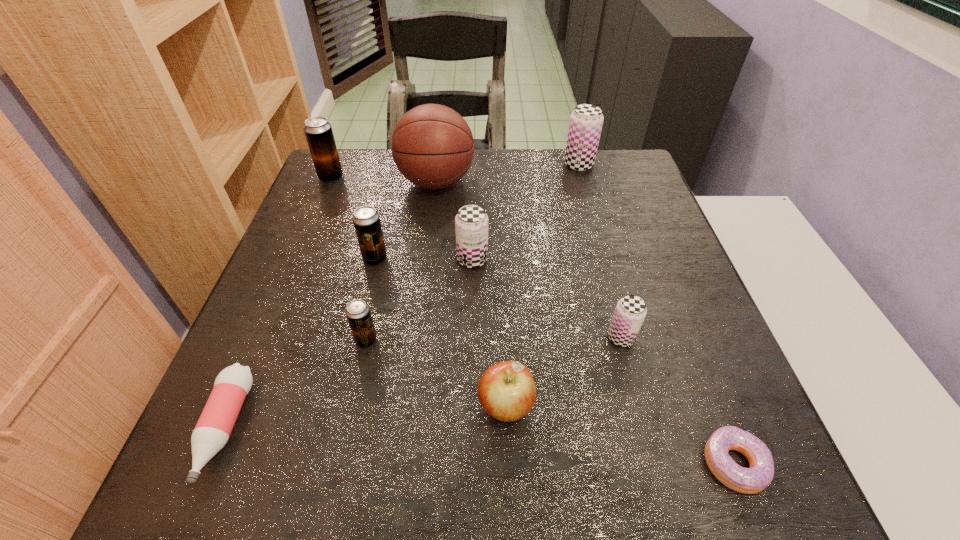
This screenshot has height=540, width=960. Identify the location of object that is the closest one to the purple doughnut. (630, 312).

What are the coordinates of `beer can that stands as the sixth closest to the second shortest object` in the screenshot? It's located at (586, 121).

The width and height of the screenshot is (960, 540). What are the coordinates of `beer can that is the closest to the fourth beer can from left to right` in the screenshot? It's located at (366, 220).

Select which purple beer can appears as the third closest to the basketball. Please provide its 2D coordinates. Your answer should be formatted as a tuple, i.e. [(x, y)], where the tuple contains the x and y coordinates of a point satisfying the conditions above.

[(630, 312)]

Locate which purple beer can is the third closest to the nearest black beer can. Please provide its 2D coordinates. Your answer should be formatted as a tuple, i.e. [(x, y)], where the tuple contains the x and y coordinates of a point satisfying the conditions above.

[(586, 121)]

Where is `black beer can that is the third closest to the pink bottle`? The height and width of the screenshot is (540, 960). black beer can that is the third closest to the pink bottle is located at coordinates (318, 131).

Where is `the closest black beer can to the leftmost purple beer can`? the closest black beer can to the leftmost purple beer can is located at coordinates (366, 220).

The height and width of the screenshot is (540, 960). I want to click on free space that satisfies the following two spatial constraints: 1. on the front side of the shortest object; 2. on the left side of the farthest purple beer can, so click(664, 463).

Find the location of a particular element. vacant position in the image that satisfies the following two spatial constraints: 1. on the back side of the tallest object; 2. on the left side of the farthest purple beer can is located at coordinates (439, 165).